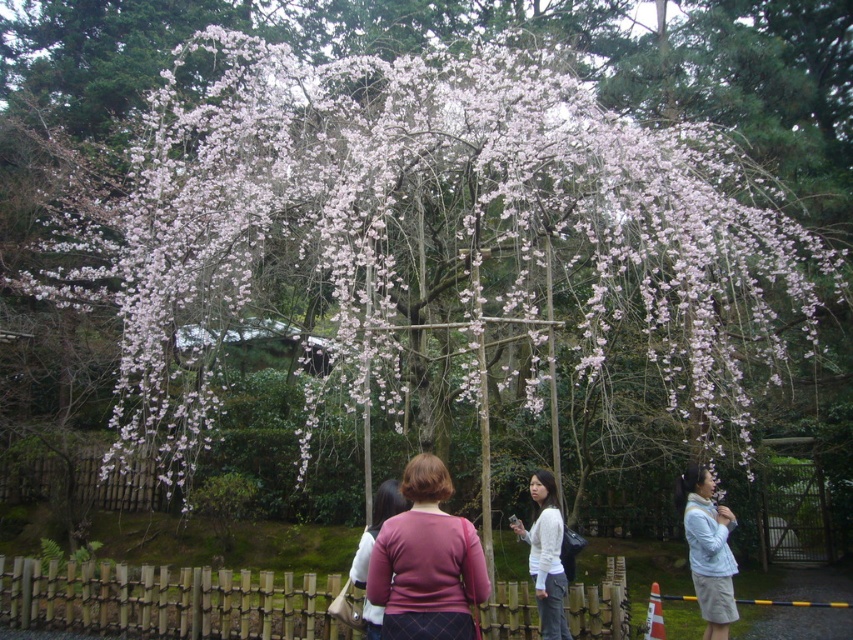
Question: Considering the relative positions of light blue sweater at lower right and matte pink sweater at center in the image provided, where is light blue sweater at lower right located with respect to matte pink sweater at center?

Choices:
 (A) below
 (B) above

Answer: (A)

Question: Is light blue sweater at lower right above matte pink sweater at center?

Choices:
 (A) yes
 (B) no

Answer: (B)

Question: Based on their relative distances, which object is farther from the white matte shirt at center?

Choices:
 (A) pink fabric sweater at center
 (B) wooden at center
 (C) light blue sweater at lower right

Answer: (B)

Question: Which point is closer to the camera taking this photo?

Choices:
 (A) (276, 621)
 (B) (558, 534)

Answer: (B)

Question: Estimate the real-world distances between objects in this image. Which object is closer to the light blue sweater at lower right?

Choices:
 (A) white matte shirt at center
 (B) matte pink sweater at center

Answer: (A)

Question: Can you confirm if light blue sweater at lower right is smaller than white matte shirt at center?

Choices:
 (A) no
 (B) yes

Answer: (A)